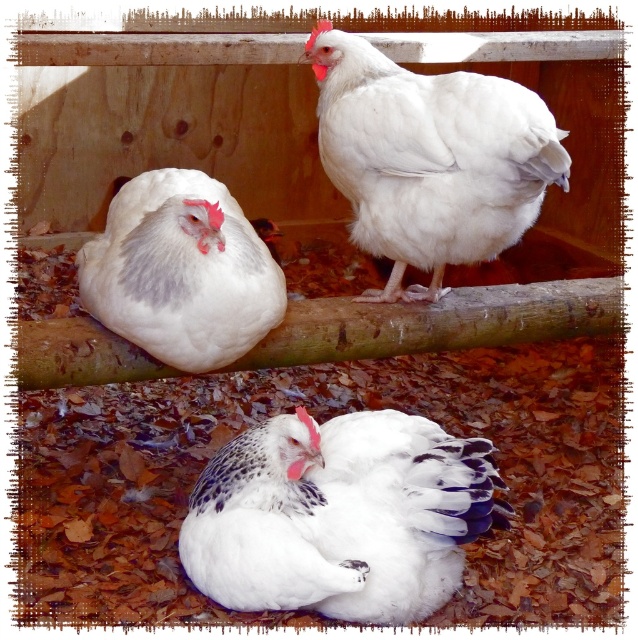
Can you confirm if white feathered chicken at center is smaller than white fluffy chicken at upper center?

Yes.

Which is behind, point (256, 541) or point (403, 260)?

The point (403, 260) is behind.

Which is behind, point (427, 548) or point (500, 122)?

The point (500, 122) is more distant.

Locate an element on the screen. This screenshot has width=638, height=640. white feathered chicken at center is located at coordinates (339, 515).

Is white feathered chicken at center below white fluffy chicken at upper left?

Yes.

Who is shorter, white feathered chicken at center or white fluffy chicken at upper left?

With less height is white feathered chicken at center.

Find the location of a particular element. The image size is (638, 640). white feathered chicken at center is located at coordinates (339, 515).

Is point (459, 243) positioned before point (186, 184)?

That is False.

Is white fluffy chicken at upper center taller than white fluffy chicken at upper left?

Yes, white fluffy chicken at upper center is taller than white fluffy chicken at upper left.

The height and width of the screenshot is (640, 638). In order to click on white fluffy chicken at upper center in this screenshot , I will do tap(429, 157).